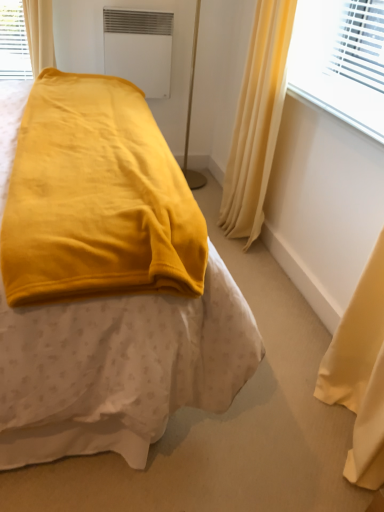
Identify the location of white matte air conditioning unit at upper center. This screenshot has height=512, width=384. (139, 48).

How different are the orientations of silky yellow curtain at upper right and white matte air conditioning unit at upper center in degrees?

The facing directions of silky yellow curtain at upper right and white matte air conditioning unit at upper center are 90 degrees apart.

From the image's perspective, relative to white matte air conditioning unit at upper center, is silky yellow curtain at upper right above or below?

Based on their image positions, silky yellow curtain at upper right is located beneath white matte air conditioning unit at upper center.

The height and width of the screenshot is (512, 384). I want to click on air conditioning above the silky yellow curtain at upper right (from the image's perspective), so click(x=139, y=48).

Which is more to the left, silky yellow curtain at upper right or white matte air conditioning unit at upper center?

From the viewer's perspective, white matte air conditioning unit at upper center appears more on the left side.

Which of these two, white matte air conditioning unit at upper center or silky yellow curtain at upper right, is thinner?

white matte air conditioning unit at upper center is thinner.

From a real-world perspective, who is located higher, white matte air conditioning unit at upper center or silky yellow curtain at upper right?

white matte air conditioning unit at upper center is physically above.

Is the position of white matte air conditioning unit at upper center more distant than that of silky yellow curtain at upper right?

Yes, the depth of white matte air conditioning unit at upper center is greater than that of silky yellow curtain at upper right.

Based on the photo, from the image's perspective, which object appears higher, white matte air conditioning unit at upper center or silky yellow curtain at upper right?

white matte air conditioning unit at upper center is shown above in the image.

Can you confirm if silky yellow curtain at upper right is positioned to the left of smooth plastic window sill at upper right?

Correct, you'll find silky yellow curtain at upper right to the left of smooth plastic window sill at upper right.

How different are the orientations of silky yellow curtain at upper right and smooth plastic window sill at upper right in degrees?

The angle between the facing direction of silky yellow curtain at upper right and the facing direction of smooth plastic window sill at upper right is 0.000956 degrees.

Is silky yellow curtain at upper right further to the viewer compared to smooth plastic window sill at upper right?

Yes.

Can you confirm if smooth plastic window sill at upper right is thinner than white matte air conditioning unit at upper center?

In fact, smooth plastic window sill at upper right might be wider than white matte air conditioning unit at upper center.

Would you say smooth plastic window sill at upper right is to the left or to the right of white matte air conditioning unit at upper center in the picture?

From the image, it's evident that smooth plastic window sill at upper right is to the right of white matte air conditioning unit at upper center.

From a real-world perspective, is smooth plastic window sill at upper right positioned above or below white matte air conditioning unit at upper center?

smooth plastic window sill at upper right is above white matte air conditioning unit at upper center.

Can you confirm if smooth plastic window sill at upper right is smaller than white matte air conditioning unit at upper center?

Correct, smooth plastic window sill at upper right occupies less space than white matte air conditioning unit at upper center.

In the image, is smooth plastic window sill at upper right on the left side or the right side of velvet yellow blanket at center?

Based on their positions, smooth plastic window sill at upper right is located to the right of velvet yellow blanket at center.

From the image's perspective, does smooth plastic window sill at upper right appear lower than velvet yellow blanket at center?

No.

Is smooth plastic window sill at upper right not within velvet yellow blanket at center?

Yes, smooth plastic window sill at upper right is outside of velvet yellow blanket at center.

Between smooth plastic window sill at upper right and velvet yellow blanket at center, which one has smaller size?

With smaller size is smooth plastic window sill at upper right.

Considering the sizes of objects velvet yellow blanket at center and silky yellow curtain at upper right in the image provided, who is thinner, velvet yellow blanket at center or silky yellow curtain at upper right?

silky yellow curtain at upper right.

Between velvet yellow blanket at center and silky yellow curtain at upper right, which one has more height?

Standing taller between the two is velvet yellow blanket at center.

Identify the location of curtain on the right of velvet yellow blanket at center. (257, 120).

Measure the distance between smooth plastic window sill at upper right and silky yellow curtain at upper right.

smooth plastic window sill at upper right is 13.50 inches away from silky yellow curtain at upper right.

From the image's perspective, does smooth plastic window sill at upper right appear higher than silky yellow curtain at upper right?

Incorrect, from the image's perspective, smooth plastic window sill at upper right is lower than silky yellow curtain at upper right.

Does point (315, 96) appear closer or farther from the camera than point (259, 20)?

Point (315, 96) is positioned closer to the camera compared to point (259, 20).

Which is more to the left, smooth plastic window sill at upper right or silky yellow curtain at upper right?

From the viewer's perspective, silky yellow curtain at upper right appears more on the left side.

The width and height of the screenshot is (384, 512). Identify the location of air conditioning above the silky yellow curtain at upper right (from the image's perspective). (139, 48).

Find the location of a particular element. curtain lying below the white matte air conditioning unit at upper center (from the image's perspective) is located at coordinates (257, 120).

From the image, which object appears to be farther from smooth plastic window sill at upper right, white matte air conditioning unit at upper center or velvet yellow blanket at center?

Based on the image, velvet yellow blanket at center appears to be further to smooth plastic window sill at upper right.

When comparing their distances from smooth plastic window sill at upper right, does velvet yellow blanket at center or silky yellow curtain at upper right seem further?

Among the two, velvet yellow blanket at center is located further to smooth plastic window sill at upper right.

Which object lies nearer to the anchor point smooth plastic window sill at upper right, white matte air conditioning unit at upper center or silky yellow curtain at upper right?

silky yellow curtain at upper right.

Considering their positions, is smooth plastic window sill at upper right positioned further to silky yellow curtain at upper right than velvet yellow blanket at center?

Based on the image, velvet yellow blanket at center appears to be further to silky yellow curtain at upper right.

Which object lies further to the anchor point silky yellow curtain at upper right, velvet yellow blanket at center or white matte air conditioning unit at upper center?

velvet yellow blanket at center.

From the image, which object appears to be nearer to silky yellow curtain at upper right, white matte air conditioning unit at upper center or velvet yellow blanket at center?

The object closer to silky yellow curtain at upper right is white matte air conditioning unit at upper center.

Based on their spatial positions, is smooth plastic window sill at upper right or silky yellow curtain at upper right further from velvet yellow blanket at center?

silky yellow curtain at upper right lies further to velvet yellow blanket at center than the other object.

Looking at the image, which one is located further to smooth plastic window sill at upper right, silky yellow curtain at upper right or white matte air conditioning unit at upper center?

white matte air conditioning unit at upper center lies further to smooth plastic window sill at upper right than the other object.

This screenshot has width=384, height=512. Find the location of `curtain located between velvet yellow blanket at center and white matte air conditioning unit at upper center in the depth direction`. curtain located between velvet yellow blanket at center and white matte air conditioning unit at upper center in the depth direction is located at coordinates (257, 120).

Where is `curtain between smooth plastic window sill at upper right and white matte air conditioning unit at upper center along the z-axis`? This screenshot has height=512, width=384. curtain between smooth plastic window sill at upper right and white matte air conditioning unit at upper center along the z-axis is located at coordinates click(257, 120).

Where is `window sill located between velvet yellow blanket at center and silky yellow curtain at upper right in the depth direction`? This screenshot has height=512, width=384. window sill located between velvet yellow blanket at center and silky yellow curtain at upper right in the depth direction is located at coordinates (338, 113).

Identify the location of window sill positioned between velvet yellow blanket at center and white matte air conditioning unit at upper center from near to far. (338, 113).